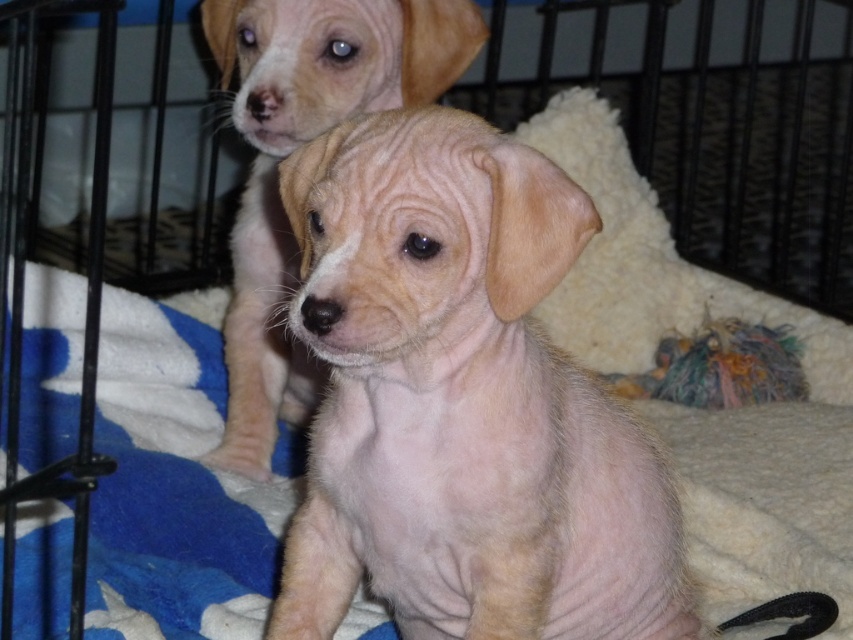
Question: Is white fleece blanket at center further to the viewer compared to light brown fur at center?

Choices:
 (A) yes
 (B) no

Answer: (B)

Question: Does light beige fur at center appear on the right side of light brown fur at center?

Choices:
 (A) no
 (B) yes

Answer: (B)

Question: Which is nearer to the light brown fur at center?

Choices:
 (A) light beige fur at center
 (B) white fleece blanket at center

Answer: (B)

Question: Which point is farther from the camera taking this photo?

Choices:
 (A) (352, 74)
 (B) (28, 566)

Answer: (A)

Question: Which object appears closest to the camera in this image?

Choices:
 (A) light beige fur at center
 (B) light brown fur at center
 (C) white fleece blanket at center

Answer: (A)

Question: Is white fleece blanket at center positioned in front of light brown fur at center?

Choices:
 (A) yes
 (B) no

Answer: (A)